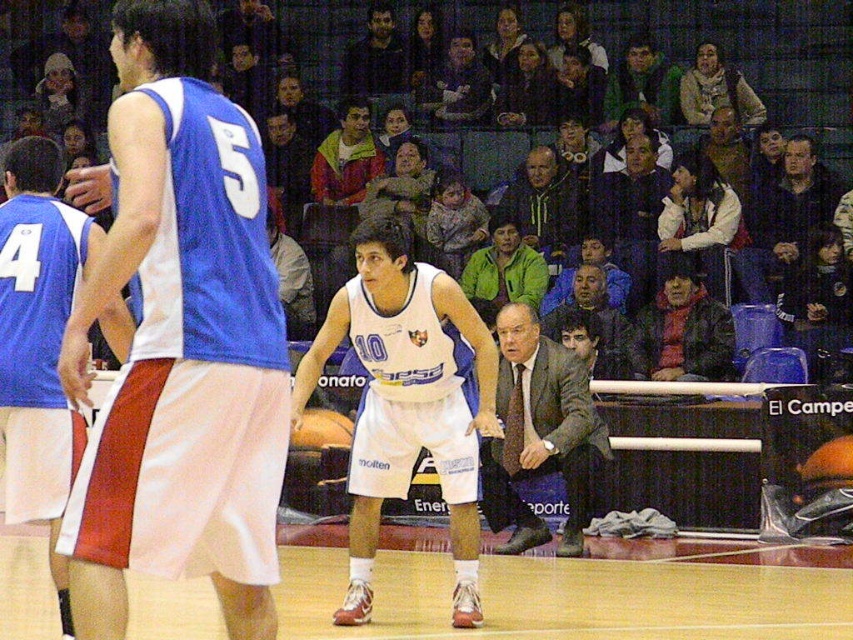
You are a spectator at the basketball game and want to know which of the two points, point (16, 458) or point (45, 509), is closer to you. Based on the image, which point is nearer?

Point (16, 458) is further to the camera than point (45, 509), so the point closer to you is point (45, 509).

You are a photographer at a formal event and need to capture a photo of both the gray wool jacket at center and the dark blue suit at center. Considering their positions, which one is positioned to the left side of the other?

The gray wool jacket at center is positioned to the left side of the dark blue suit at center.